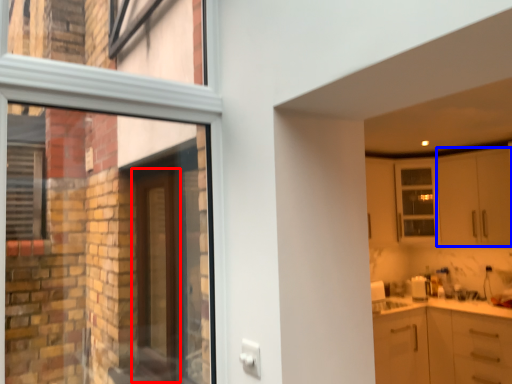
Question: Which object appears closest to the camera in this image, door (highlighted by a red box) or cabinetry (highlighted by a blue box)?

Choices:
 (A) door
 (B) cabinetry

Answer: (A)